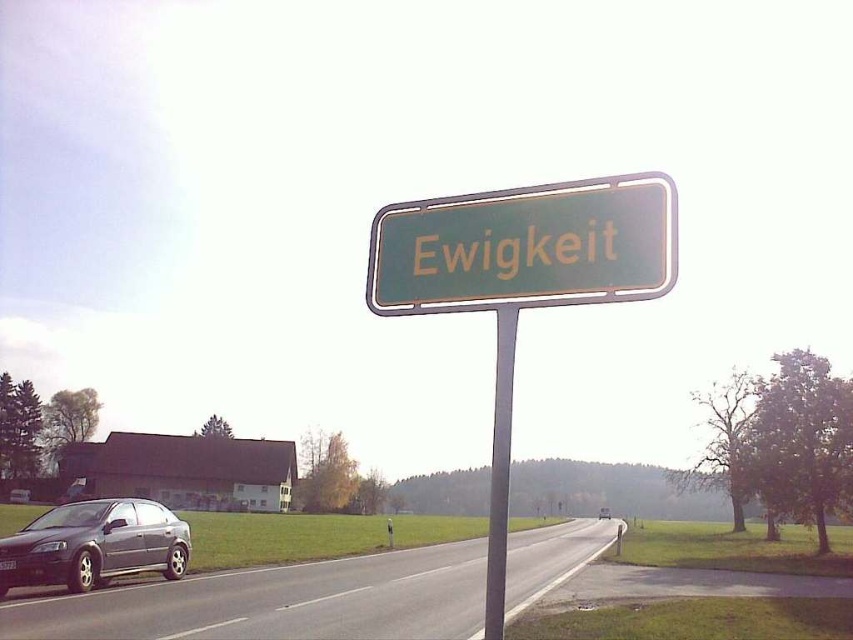
Question: Which point appears farthest from the camera in this image?

Choices:
 (A) (500, 433)
 (B) (595, 260)

Answer: (A)

Question: Which is farther from the metallic gray sedan at lower left?

Choices:
 (A) metallic gray pole at center
 (B) green metallic sign at center

Answer: (B)

Question: Is green metallic sign at center above metallic gray pole at center?

Choices:
 (A) yes
 (B) no

Answer: (A)

Question: Does green metallic sign at center have a larger size compared to metallic gray sedan at lower left?

Choices:
 (A) yes
 (B) no

Answer: (B)

Question: Which of the following is the closest to the observer?

Choices:
 (A) (647, 179)
 (B) (500, 582)

Answer: (B)

Question: Can you confirm if green metallic sign at center is positioned to the right of metallic gray sedan at lower left?

Choices:
 (A) yes
 (B) no

Answer: (A)